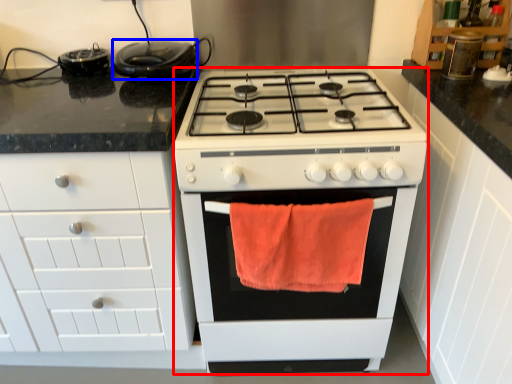
Question: Which of the following is the farthest to the observer, appliance (highlighted by a red box) or kitchen appliance (highlighted by a blue box)?

Choices:
 (A) appliance
 (B) kitchen appliance

Answer: (B)